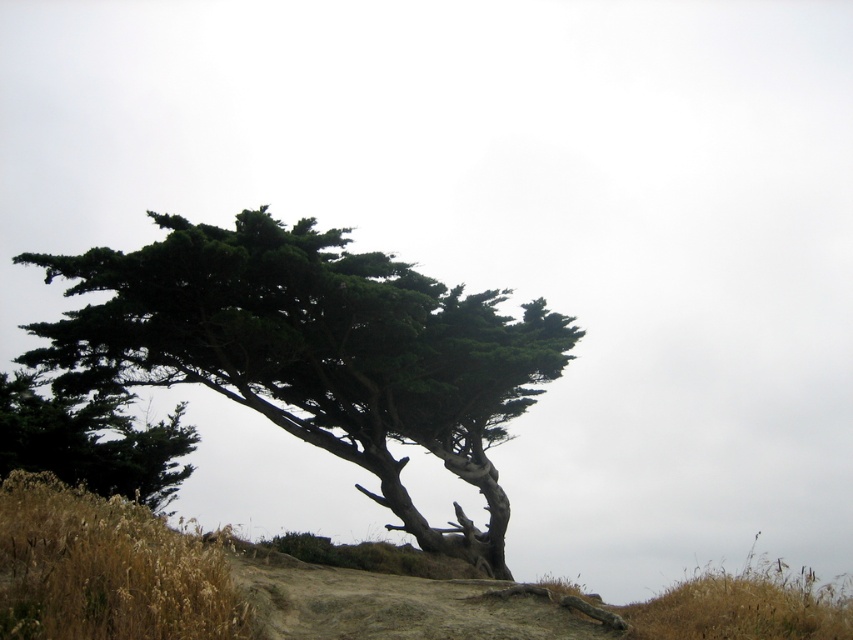
You are a hiker trying to determine the tallest tree between the green leafy tree at center and the green leafy tree at left. According to the scene, which one is taller?

The green leafy tree at center is taller than the green leafy tree at left.

In the scene shown: You are a hiker trying to determine which tree to rest under for shade. You see the green leafy tree at center and the green leafy tree at left. Which one provides more shade?

The green leafy tree at center provides more shade because it is bigger than the green leafy tree at left.